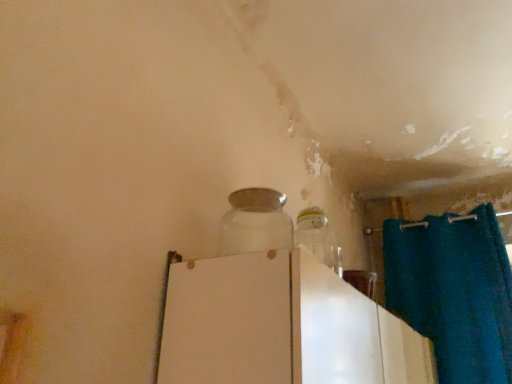
Question: From a real-world perspective, does transparent glass jar at center stand above white glossy refrigerator at center?

Choices:
 (A) yes
 (B) no

Answer: (A)

Question: Does transparent glass jar at center have a lesser width compared to white glossy refrigerator at center?

Choices:
 (A) yes
 (B) no

Answer: (A)

Question: Does transparent glass jar at center touch white glossy refrigerator at center?

Choices:
 (A) no
 (B) yes

Answer: (A)

Question: Would you consider transparent glass jar at center to be distant from white glossy refrigerator at center?

Choices:
 (A) yes
 (B) no

Answer: (B)

Question: Is transparent glass jar at center behind white glossy refrigerator at center?

Choices:
 (A) no
 (B) yes

Answer: (B)

Question: Can you confirm if transparent glass jar at center is taller than white glossy refrigerator at center?

Choices:
 (A) yes
 (B) no

Answer: (B)

Question: Would you say white glossy refrigerator at center is a long distance from transparent glass jar at center?

Choices:
 (A) yes
 (B) no

Answer: (B)

Question: Is white glossy refrigerator at center smaller than transparent glass jar at center?

Choices:
 (A) no
 (B) yes

Answer: (A)

Question: Can you confirm if white glossy refrigerator at center is taller than transparent glass jar at center?

Choices:
 (A) no
 (B) yes

Answer: (B)

Question: From a real-world perspective, is white glossy refrigerator at center located higher than transparent glass jar at center?

Choices:
 (A) yes
 (B) no

Answer: (B)

Question: Is white glossy refrigerator at center directly adjacent to transparent glass jar at center?

Choices:
 (A) yes
 (B) no

Answer: (B)

Question: From the image's perspective, would you say white glossy refrigerator at center is positioned over transparent glass jar at center?

Choices:
 (A) no
 (B) yes

Answer: (A)

Question: From the image's perspective, is white glossy refrigerator at center above or below transparent glass jar at center?

Choices:
 (A) below
 (B) above

Answer: (A)